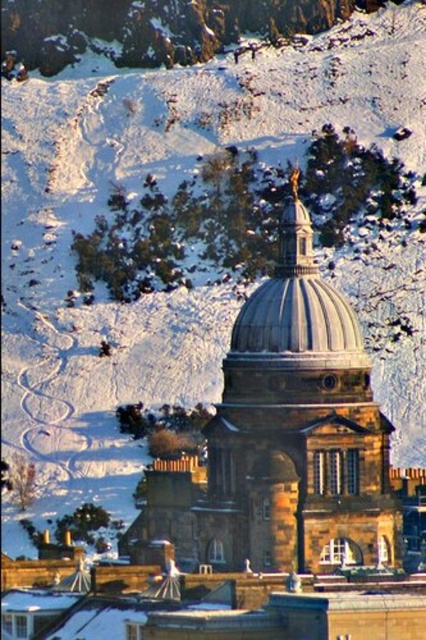
Question: Does smooth stone dome at center appear on the left side of shiny silver dome at center?

Choices:
 (A) yes
 (B) no

Answer: (A)

Question: Can you confirm if smooth stone dome at center is positioned to the left of shiny silver dome at center?

Choices:
 (A) no
 (B) yes

Answer: (B)

Question: Among these points, which one is nearest to the camera?

Choices:
 (A) pyautogui.click(x=288, y=275)
 (B) pyautogui.click(x=279, y=566)

Answer: (B)

Question: Is smooth stone dome at center to the left of shiny silver dome at center from the viewer's perspective?

Choices:
 (A) no
 (B) yes

Answer: (B)